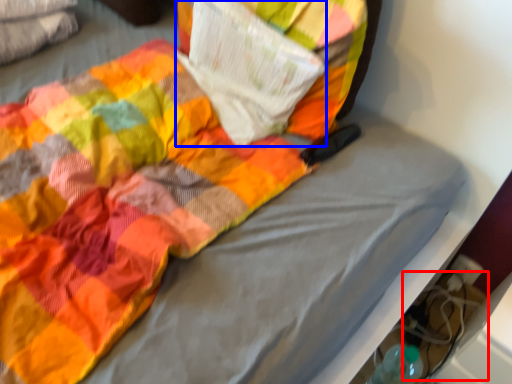
Question: Among these objects, which one is nearest to the camera, footwear (highlighted by a red box) or paperback book (highlighted by a blue box)?

Choices:
 (A) footwear
 (B) paperback book

Answer: (B)